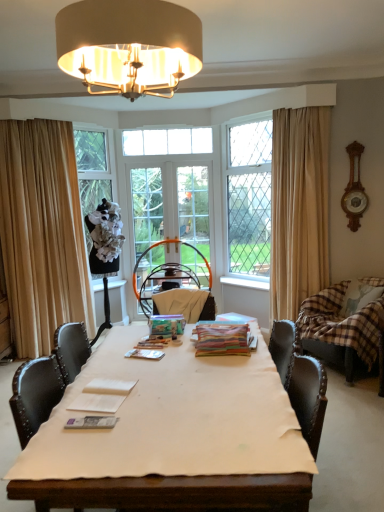
Where is `empty space that is ontop of white cloth at center (from a real-world perspective)`? This screenshot has width=384, height=512. empty space that is ontop of white cloth at center (from a real-world perspective) is located at coordinates (178, 398).